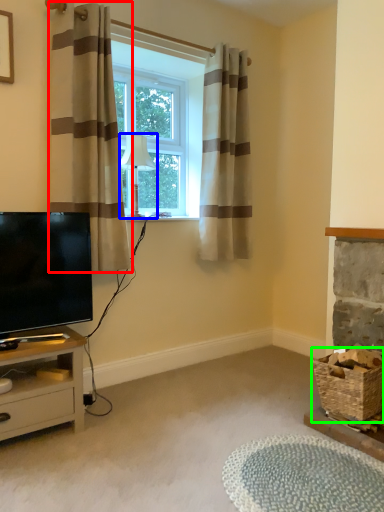
Question: Estimate the real-world distances between objects in this image. Which object is closer to curtain (highlighted by a red box), lamp (highlighted by a blue box) or basket (highlighted by a green box)?

Choices:
 (A) lamp
 (B) basket

Answer: (A)